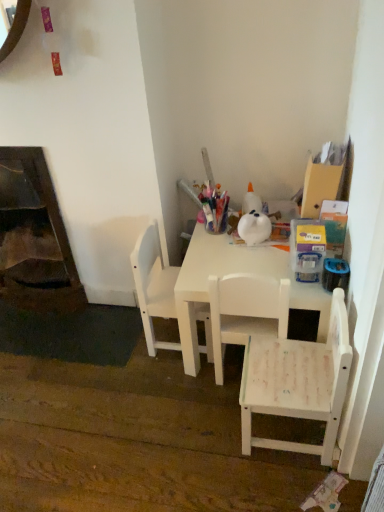
Question: Are dark brown wood fireplace at lower left and white matte chair at center, the 2th chair when ordered from left to right, beside each other?

Choices:
 (A) no
 (B) yes

Answer: (A)

Question: Is dark brown wood fireplace at lower left far away from white matte chair at center, the 2th chair when ordered from left to right?

Choices:
 (A) no
 (B) yes

Answer: (A)

Question: Can you confirm if dark brown wood fireplace at lower left is positioned to the left of white matte chair at center, the 2th chair when ordered from left to right?

Choices:
 (A) yes
 (B) no

Answer: (A)

Question: Does dark brown wood fireplace at lower left lie in front of white matte chair at center, the 2th chair when ordered from left to right?

Choices:
 (A) yes
 (B) no

Answer: (B)

Question: Considering the relative sizes of dark brown wood fireplace at lower left and white matte chair at center, acting as the second chair starting from the right, in the image provided, is dark brown wood fireplace at lower left taller than white matte chair at center, acting as the second chair starting from the right,?

Choices:
 (A) yes
 (B) no

Answer: (A)

Question: Does dark brown wood fireplace at lower left have a larger size compared to white matte chair at center, the 2th chair when ordered from left to right?

Choices:
 (A) yes
 (B) no

Answer: (A)

Question: Can you confirm if white matte chair at lower right, marked as the third chair in a left-to-right arrangement, is taller than dark brown wood fireplace at lower left?

Choices:
 (A) no
 (B) yes

Answer: (A)

Question: From the image's perspective, is white matte chair at lower right, marked as the third chair in a left-to-right arrangement, on top of dark brown wood fireplace at lower left?

Choices:
 (A) no
 (B) yes

Answer: (A)

Question: Is the position of white matte chair at lower right, marked as the third chair in a left-to-right arrangement, more distant than that of dark brown wood fireplace at lower left?

Choices:
 (A) yes
 (B) no

Answer: (B)

Question: Is white matte chair at lower right, the 1th chair viewed from the right, surrounding dark brown wood fireplace at lower left?

Choices:
 (A) no
 (B) yes

Answer: (A)

Question: Can you confirm if white matte chair at lower right, the 1th chair viewed from the right, is thinner than dark brown wood fireplace at lower left?

Choices:
 (A) yes
 (B) no

Answer: (B)

Question: Is white matte chair at lower right, the 1th chair viewed from the right, shorter than dark brown wood fireplace at lower left?

Choices:
 (A) yes
 (B) no

Answer: (A)

Question: From a real-world perspective, is white matte chair at center, positioned as the 1th chair in left-to-right order, located higher than dark brown wood fireplace at lower left?

Choices:
 (A) no
 (B) yes

Answer: (A)